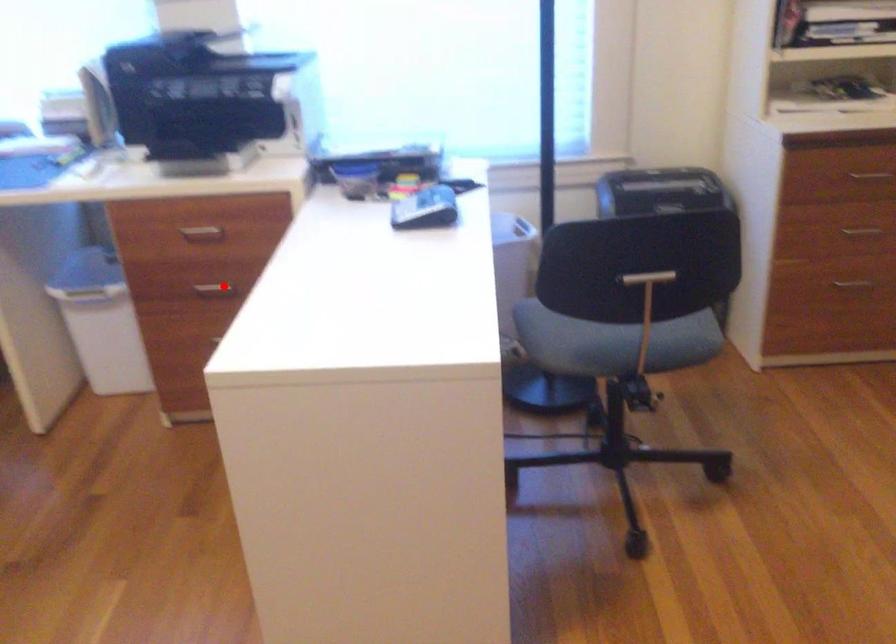
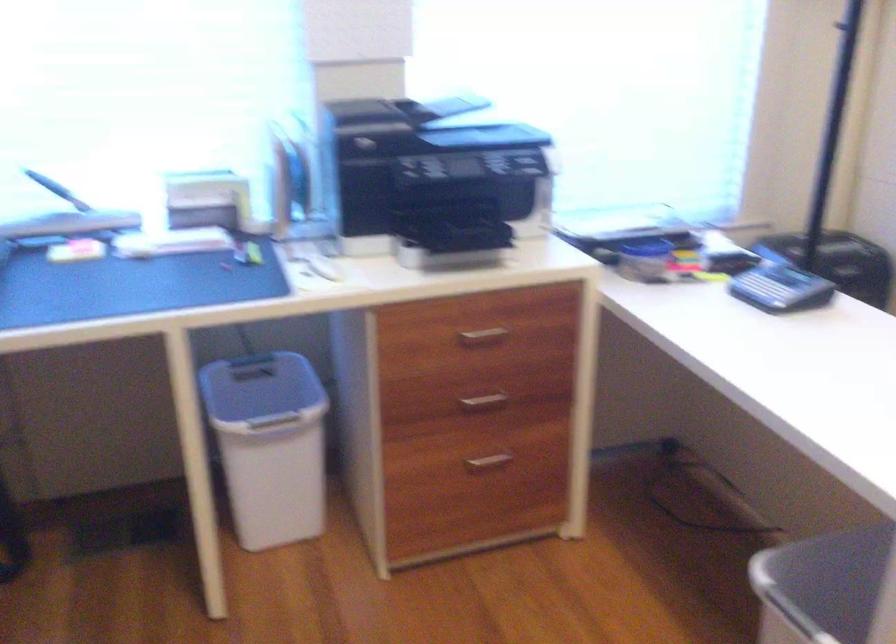
Question: A red point is marked in image1. In image2, is the corresponding 3D point closer to the camera or farther? Reply with the corresponding letter.

Choices:
 (A) The corresponding 3D point is closer.
 (B) The corresponding 3D point is farther.

Answer: (A)